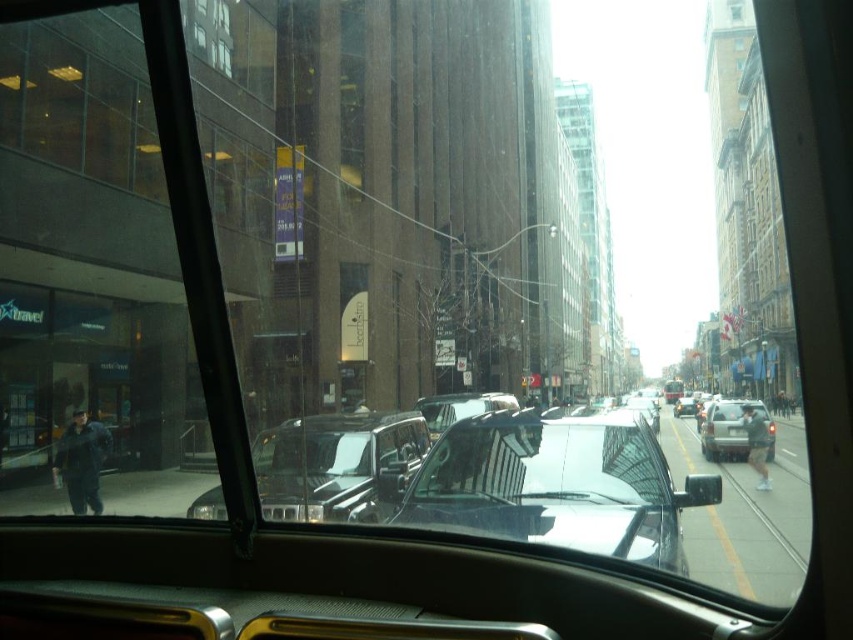
Question: Which object is closer to the camera taking this photo?

Choices:
 (A) transparent glass windshield at center
 (B) silver metallic suv at center

Answer: (A)

Question: Does transparent glass windshield at center appear under silver metallic suv at center?

Choices:
 (A) yes
 (B) no

Answer: (B)

Question: From the image, what is the correct spatial relationship of transparent glass windshield at center in relation to silver metallic suv at center?

Choices:
 (A) right
 (B) left

Answer: (B)

Question: Is transparent glass windshield at center closer to camera compared to silver metallic suv at center?

Choices:
 (A) yes
 (B) no

Answer: (A)

Question: Which object is farther from the camera taking this photo?

Choices:
 (A) silver metallic suv at center
 (B) transparent glass windshield at center

Answer: (A)